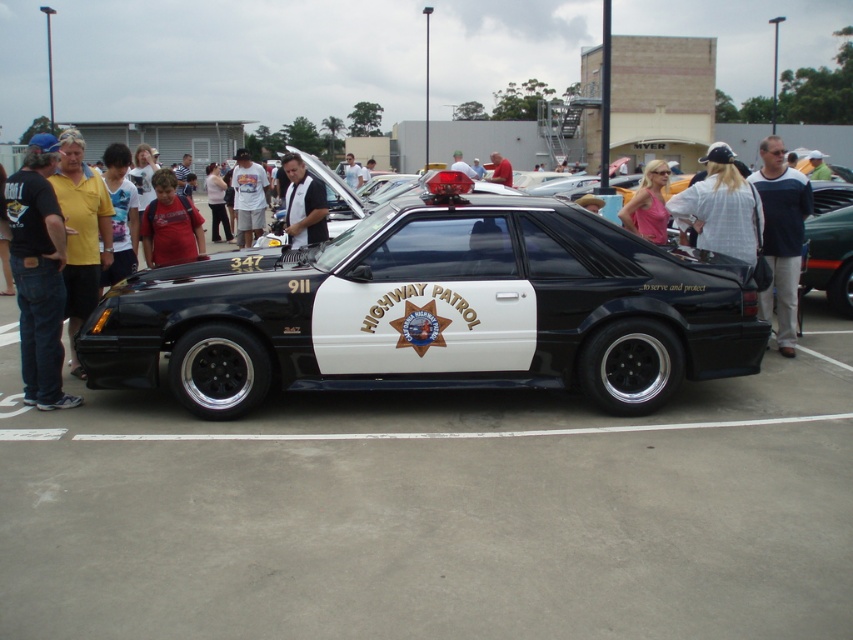
You are an event organizer at the car show and need to decide which shirt to display on the CHP vehicle. The black leather shirt at center and the white shirt at center are both options. Which shirt has a larger size?

The white shirt at center is larger than the black leather shirt at center.